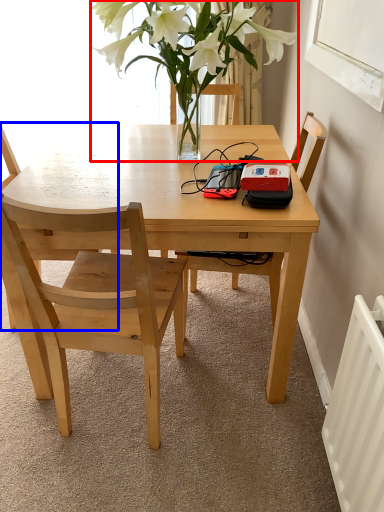
Question: Among these objects, which one is nearest to the camera, houseplant (highlighted by a red box) or chair (highlighted by a blue box)?

Choices:
 (A) houseplant
 (B) chair

Answer: (A)